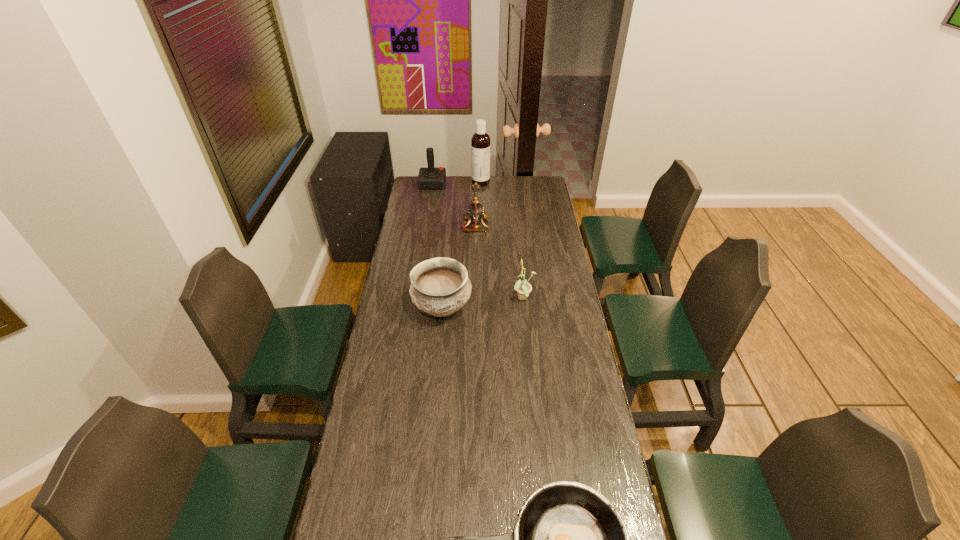
Locate an element on the screen. The image size is (960, 540). dishwasher detergent is located at coordinates (480, 142).

At what (x,y) coordinates should I click in order to perform the action: click on joystick. Please return your answer as a coordinate pair (x, y). Looking at the image, I should click on (429, 178).

You are a GUI agent. You are given a task and a screenshot of the screen. Output one action in this format:
    pyautogui.click(x=<x>, y=<y>)
    Task: Click on the telephone
    This screenshot has width=960, height=540.
    Given the screenshot: What is the action you would take?
    pyautogui.click(x=476, y=213)

Locate an element on the screen. sunflower is located at coordinates (523, 288).

Where is `pottery`? pottery is located at coordinates (440, 286).

Where is `vacant area located 0.190m on the label side of the dishwasher detergent`? This screenshot has width=960, height=540. vacant area located 0.190m on the label side of the dishwasher detergent is located at coordinates (441, 183).

Image resolution: width=960 pixels, height=540 pixels. In order to click on free region located on the label side of the dishwasher detergent in this screenshot , I will do `click(445, 183)`.

Find the location of `vacant space located on the label side of the dishwasher detergent`. vacant space located on the label side of the dishwasher detergent is located at coordinates (441, 183).

You are a GUI agent. You are given a task and a screenshot of the screen. Output one action in this format:
    pyautogui.click(x=<x>, y=<y>)
    Task: Click on the free space located on the base of the joystick
    The height and width of the screenshot is (540, 960).
    Given the screenshot: What is the action you would take?
    pyautogui.click(x=509, y=184)

Identify the location of free space located on the front of the third farthest object, featuring the rotary dial. This screenshot has width=960, height=540. (525, 226).